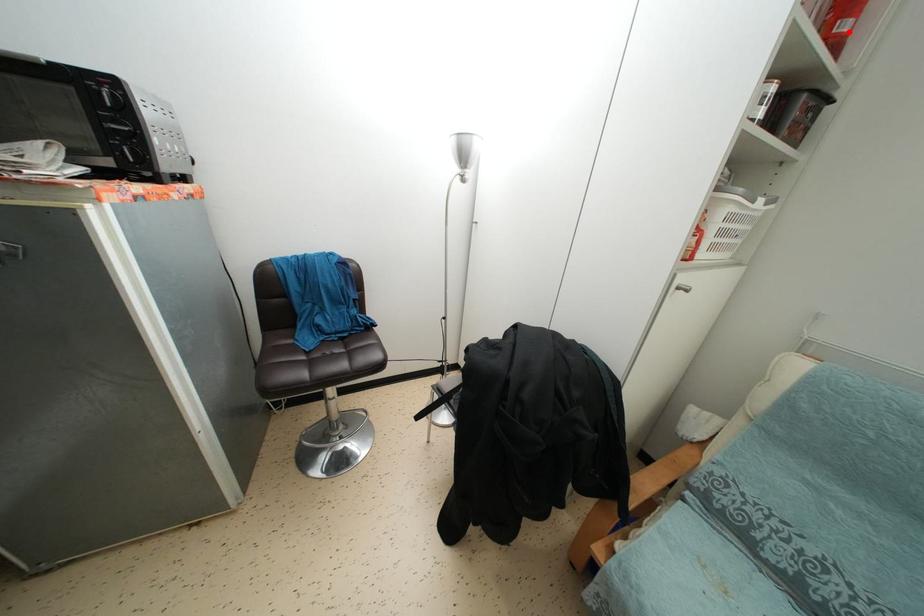
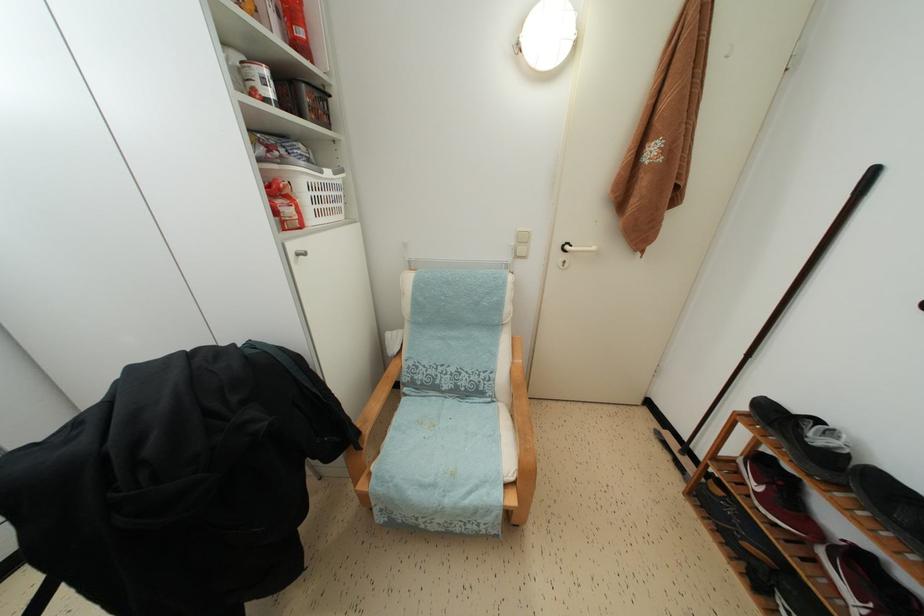
Where in the second image is the point corresponding to the highlighted location from the first image?

(305, 38)